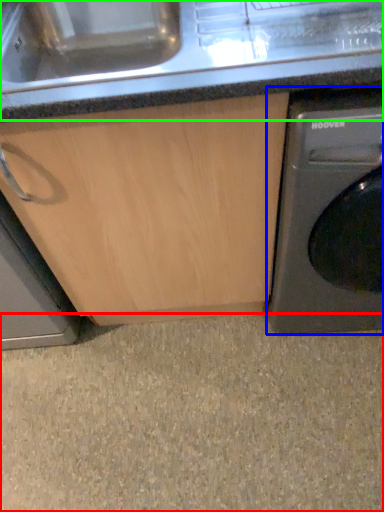
Question: Which object is positioned closest to granite (highlighted by a red box)? Select from washing machine (highlighted by a blue box) and counter top (highlighted by a green box).

Choices:
 (A) washing machine
 (B) counter top

Answer: (A)